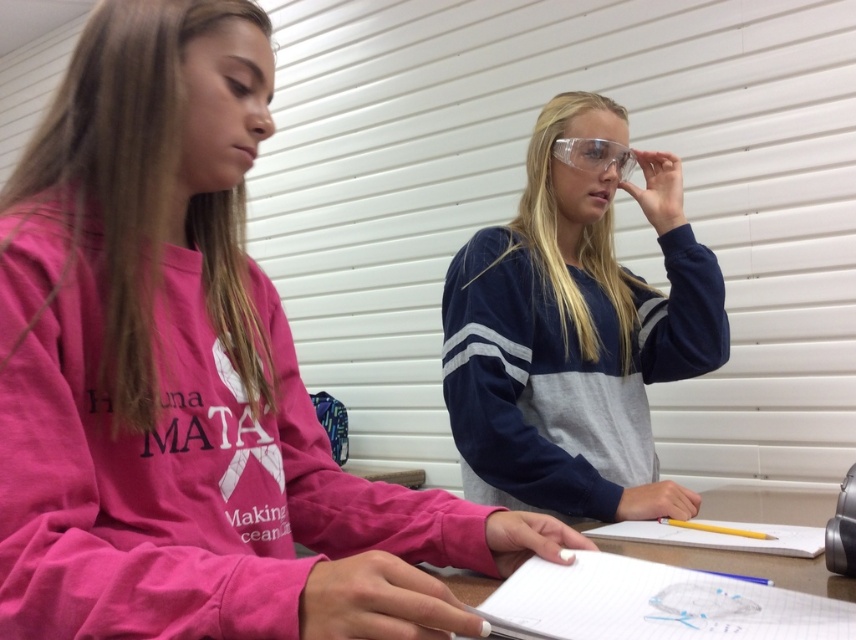
You are a student who needs to place both the clear plastic goggles at center and the white paper notebook at lower center into a storage box. The box can only accommodate items up to the size of the notebook. Which item will not fit?

The clear plastic goggles at center will not fit because its width is larger than the white paper notebook at lower center, which is the maximum size the box can hold.

You are standing in front of the image. Where is the pink sweatshirt at left located in terms of coordinates?

The pink sweatshirt at left is located at coordinates point (187,378).

You are standing at the origin of the coordinate system in the image. You see a point at coordinates (x=187, y=378). What object is located at that point?

The pink sweatshirt at left is located at point (x=187, y=378).